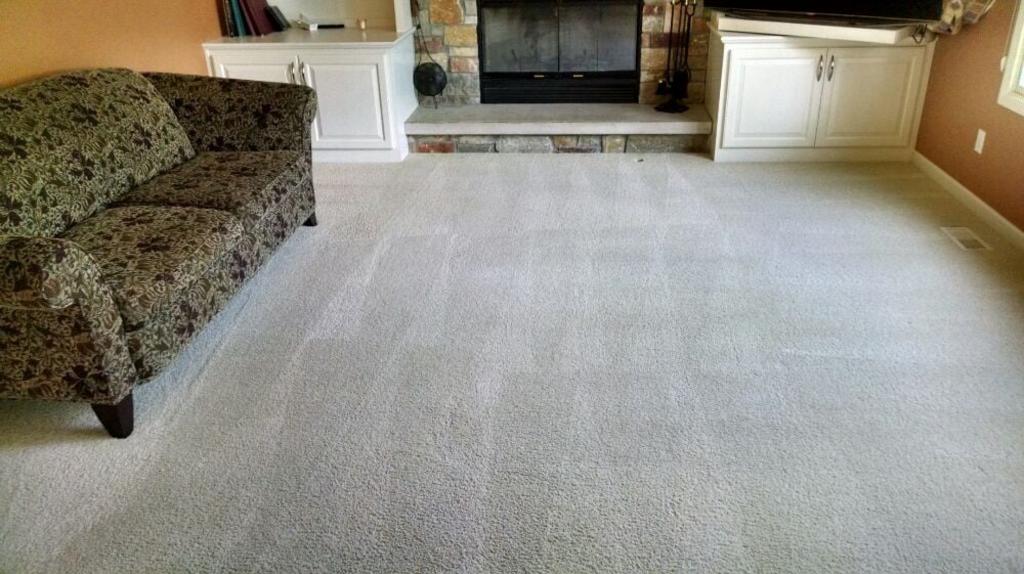
Find the location of `book`. book is located at coordinates (259, 21).